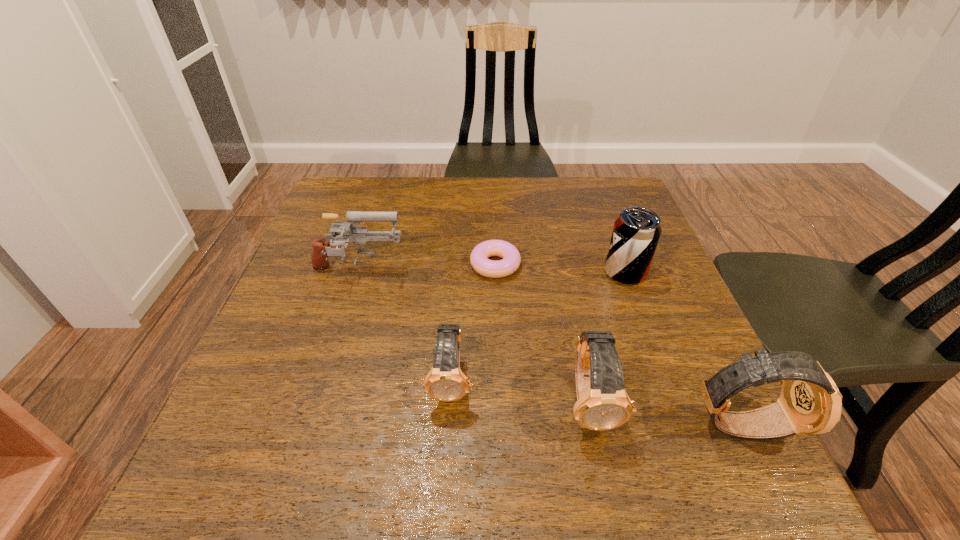
With all watchs evenly spaced, where should an extra watch be placed on the left to continue the pattern? Please point out a vacant space. Please provide its 2D coordinates. Your answer should be formatted as a tuple, i.e. [(x, y)], where the tuple contains the x and y coordinates of a point satisfying the conditions above.

[(324, 361)]